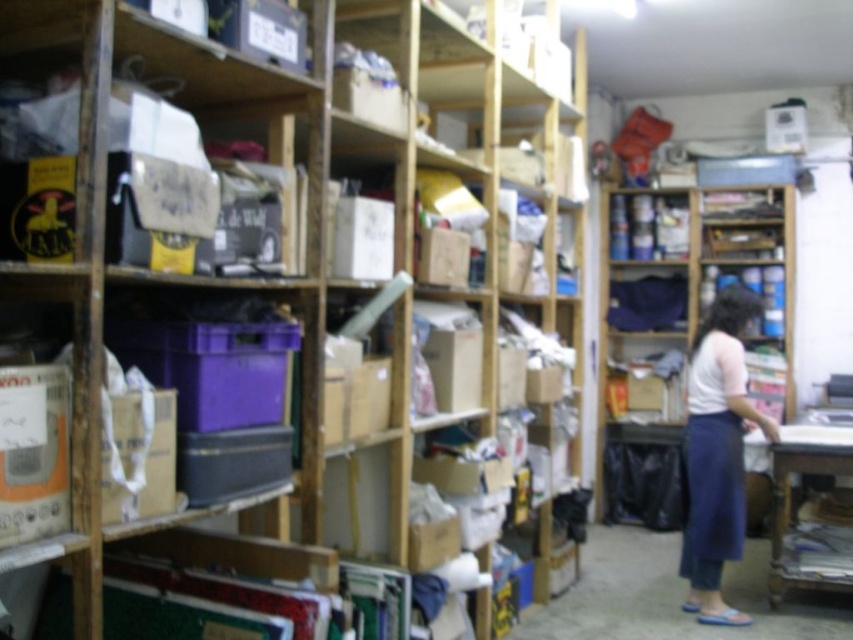
Question: Which point is closer to the camera?

Choices:
 (A) (91, 506)
 (B) (788, 214)
 (C) (712, 540)
 (D) (720, 612)

Answer: (A)

Question: Does white cotton shirt at center have a lesser width compared to blue denim apron at lower right?

Choices:
 (A) no
 (B) yes

Answer: (A)

Question: Considering the real-world distances, which object is closest to the blue denim apron at lower right?

Choices:
 (A) wooden bookshelf at center
 (B) wooden shelves at center

Answer: (B)

Question: Considering the real-world distances, which object is farthest from the blue denim apron at lower right?

Choices:
 (A) white cotton shirt at center
 (B) wooden shelves at center

Answer: (B)

Question: Is wooden shelves at center above blue denim apron at lower right?

Choices:
 (A) yes
 (B) no

Answer: (A)

Question: Is wooden bookshelf at center wider than blue denim apron at lower right?

Choices:
 (A) no
 (B) yes

Answer: (B)